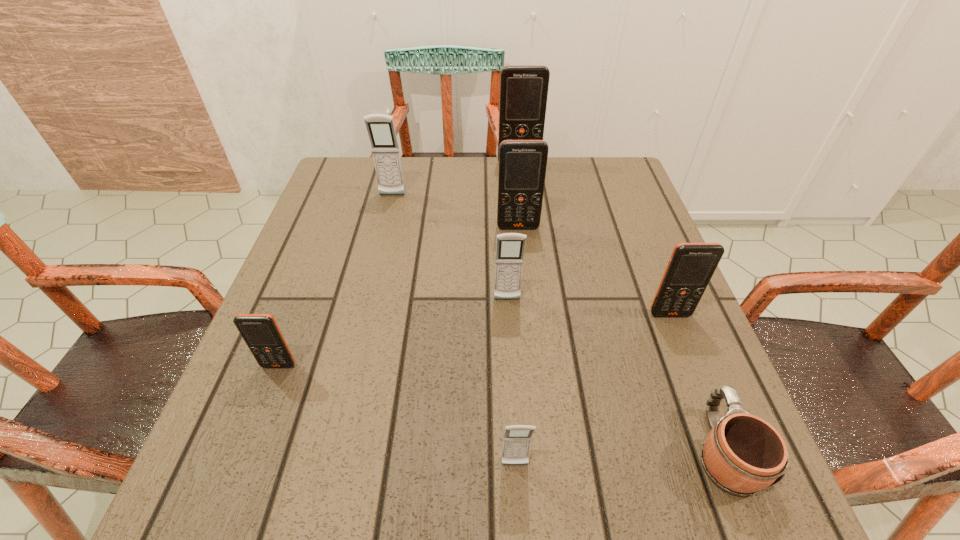
The height and width of the screenshot is (540, 960). Find the location of `free location at the far edge`. free location at the far edge is located at coordinates click(427, 176).

The image size is (960, 540). What are the coordinates of `free region at the near edge of the desktop` in the screenshot? It's located at (316, 501).

The width and height of the screenshot is (960, 540). I want to click on vacant position at the left edge of the desktop, so click(352, 254).

The width and height of the screenshot is (960, 540). Find the location of `free space at the right edge of the desktop`. free space at the right edge of the desktop is located at coordinates (631, 350).

Where is `vacant region at the far right corner of the desktop`? The height and width of the screenshot is (540, 960). vacant region at the far right corner of the desktop is located at coordinates (605, 199).

In the image, there is a desktop. What are the coordinates of `free region at the near right corner` in the screenshot? It's located at (687, 481).

Locate an element on the screen. This screenshot has height=540, width=960. free space between the leftmost cellular telephone and the smallest gray cellular telephone is located at coordinates (396, 415).

Image resolution: width=960 pixels, height=540 pixels. I want to click on free space between the third nearest orange cellular telephone and the second object from left to right, so click(x=455, y=211).

Locate an element on the screen. This screenshot has height=540, width=960. empty space that is in between the second nearest orange cellular telephone and the leftmost gray cellular telephone is located at coordinates (531, 255).

Find the location of `free space between the shortest object and the rightmost cellular telephone`. free space between the shortest object and the rightmost cellular telephone is located at coordinates (696, 382).